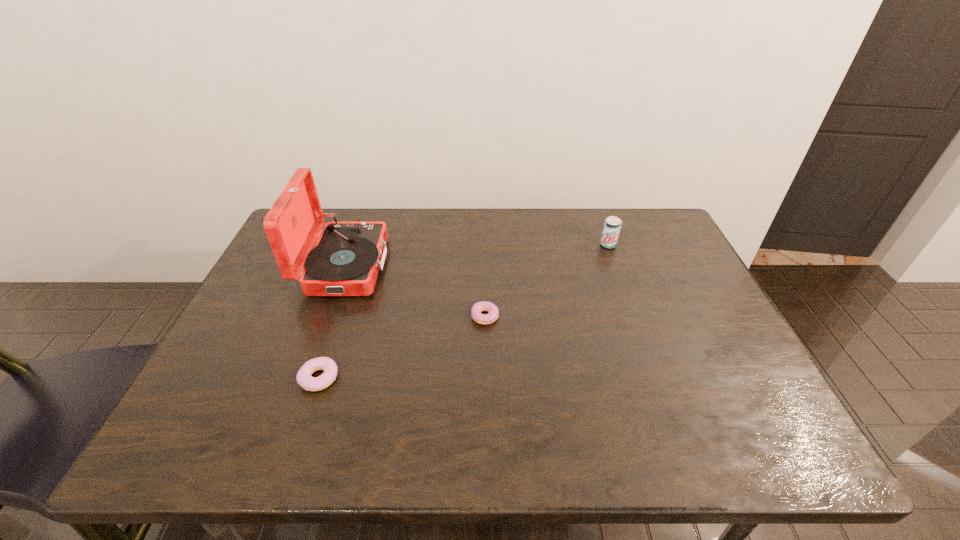
You are a GUI agent. You are given a task and a screenshot of the screen. Output one action in this format:
    pyautogui.click(x=<x>, y=<y>)
    Task: Click on the free area in between the left doughnut and the beer can
    This screenshot has width=960, height=540.
    Given the screenshot: What is the action you would take?
    pyautogui.click(x=464, y=312)

You are a GUI agent. You are given a task and a screenshot of the screen. Output one action in this format:
    pyautogui.click(x=<x>, y=<y>)
    Task: Click on the vacant area that lies between the third object from left to right and the tallest object
    
    Given the screenshot: What is the action you would take?
    pyautogui.click(x=417, y=291)

This screenshot has height=540, width=960. Find the location of `free spot between the phonograph_record and the left doughnut`. free spot between the phonograph_record and the left doughnut is located at coordinates (332, 322).

Locate an element on the screen. vacant area that lies between the tallest object and the beer can is located at coordinates (477, 255).

At what (x,y) coordinates should I click in order to perform the action: click on free area in between the second tallest object and the third farthest object. Please return your answer as a coordinate pair (x, y). Looking at the image, I should click on (548, 281).

What are the coordinates of `vacant space that is in between the second tallest object and the right doughnut` in the screenshot? It's located at (548, 281).

Find the location of a particular element. The height and width of the screenshot is (540, 960). free space between the beer can and the tallest object is located at coordinates (477, 255).

Identify the location of vacant area between the farther doughnut and the phonograph_record. (417, 291).

Find the location of a particular element. This screenshot has height=540, width=960. free area in between the second nearest object and the left doughnut is located at coordinates (403, 347).

What are the coordinates of `empty space between the nearer doughnut and the phonograph_record` in the screenshot? It's located at (332, 322).